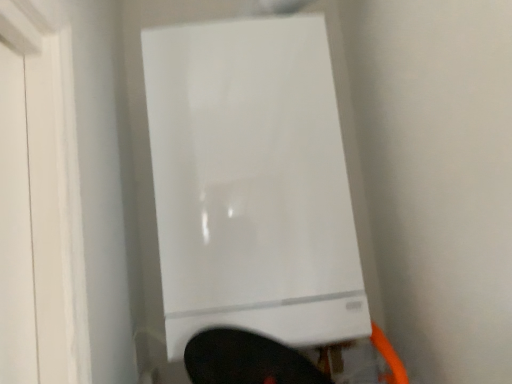
Locate an element on the screen. The height and width of the screenshot is (384, 512). white glossy boiler at center is located at coordinates (245, 176).

Describe the element at coordinates (245, 176) in the screenshot. Image resolution: width=512 pixels, height=384 pixels. I see `white glossy boiler at center` at that location.

You are a GUI agent. You are given a task and a screenshot of the screen. Output one action in this format:
    pyautogui.click(x=<x>, y=<y>)
    Task: Click on the white glossy boiler at center
    The height and width of the screenshot is (384, 512).
    Given the screenshot: What is the action you would take?
    pyautogui.click(x=245, y=176)